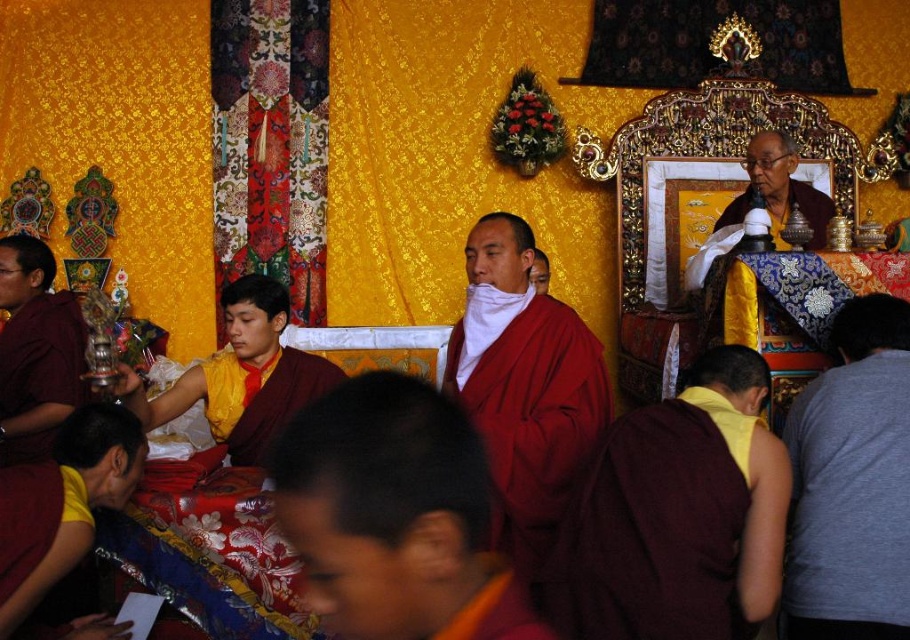
How far apart are maroon silk robe at center and yellow silk robe at center?

15.63 meters

Is point (463, 552) in front of point (224, 362)?

Yes, point (463, 552) is in front of point (224, 362).

Identify the location of maroon silk robe at center. This screenshot has height=640, width=910. (395, 515).

Can you confirm if matte red robe at left is positioned to the right of maroon robe at lower left?

In fact, matte red robe at left is to the left of maroon robe at lower left.

Who is taller, matte red robe at left or maroon robe at lower left?

With more height is matte red robe at left.

You are a GUI agent. You are given a task and a screenshot of the screen. Output one action in this format:
    pyautogui.click(x=<x>, y=<y>)
    Task: Click on the matte red robe at left
    This screenshot has height=640, width=910.
    Given the screenshot: What is the action you would take?
    coord(35,349)

Locate an element on the screen. matte red robe at left is located at coordinates (35, 349).

Is yellow cotton monk at lower right further to camera compared to gray cotton shirt at lower right?

No, it is not.

In the scene shown: Who is higher up, yellow cotton monk at lower right or gray cotton shirt at lower right?

gray cotton shirt at lower right

Measure the distance between yellow cotton monk at lower right and camera.

yellow cotton monk at lower right is 23.56 meters from camera.

Locate an element on the screen. Image resolution: width=910 pixels, height=640 pixels. yellow cotton monk at lower right is located at coordinates click(x=679, y=515).